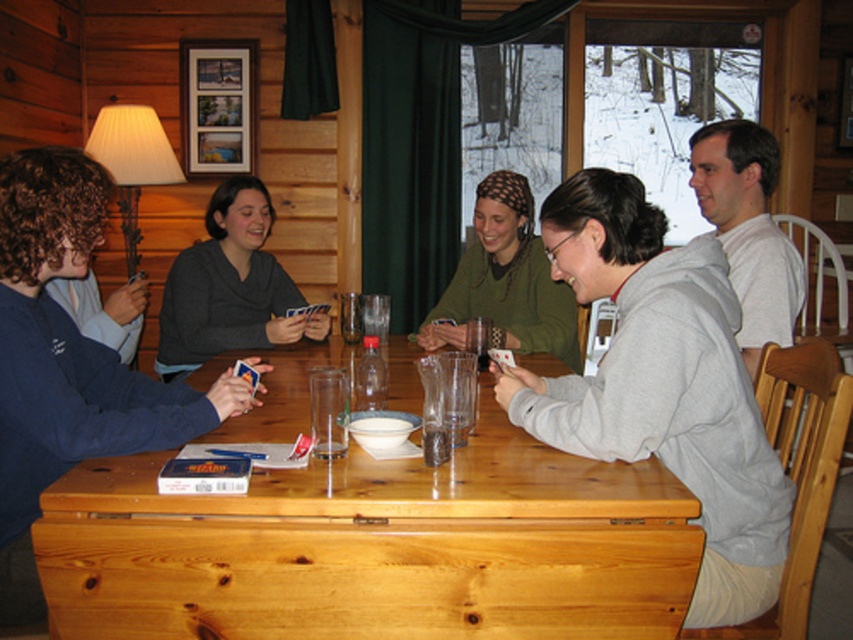
Question: Does light brown wood table at center appear over translucent glass at table center?

Choices:
 (A) yes
 (B) no

Answer: (B)

Question: Which point is farther from the camera taking this photo?

Choices:
 (A) (496, 179)
 (B) (450, 456)

Answer: (A)

Question: Does gray sweatshirt at center have a smaller size compared to white cotton shirt at upper right?

Choices:
 (A) yes
 (B) no

Answer: (B)

Question: In this image, where is light brown wood table at center located relative to white cotton shirt at upper right?

Choices:
 (A) left
 (B) right

Answer: (A)

Question: Which object is the closest to the white cotton shirt at upper right?

Choices:
 (A) green knit sweater at center
 (B) translucent glass at table center
 (C) dark gray sweater at upper left

Answer: (A)

Question: Which point is closer to the camera taking this photo?

Choices:
 (A) (747, 387)
 (B) (767, 163)
 (C) (434, 451)

Answer: (C)